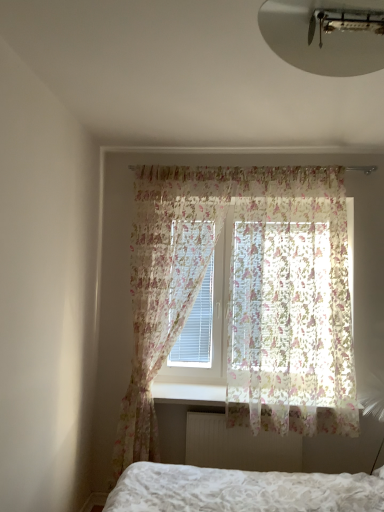
Question: Is translucent floral fabric at upper center, the 1th curtain from the right, situated inside white textured radiator at lower center or outside?

Choices:
 (A) outside
 (B) inside

Answer: (A)

Question: From a real-world perspective, is translucent floral fabric at upper center, which is counted as the 2th curtain, starting from the left, positioned above or below white textured radiator at lower center?

Choices:
 (A) above
 (B) below

Answer: (A)

Question: Based on their relative distances, which object is farther from the translucent floral fabric at upper center, which is counted as the 2th curtain, starting from the left?

Choices:
 (A) white textured bed at lower center
 (B) white plastic radiator at lower center
 (C) white matte ceiling light at upper center
 (D) white textured radiator at lower center
 (E) translucent floral fabric at center, positioned as the first curtain in left-to-right order

Answer: (C)

Question: Which object is positioned closest to the white textured radiator at lower center?

Choices:
 (A) white plastic radiator at lower center
 (B) white textured bed at lower center
 (C) white matte ceiling light at upper center
 (D) translucent floral fabric at center, positioned as the first curtain in left-to-right order
 (E) translucent floral fabric at upper center, the 1th curtain from the right

Answer: (A)